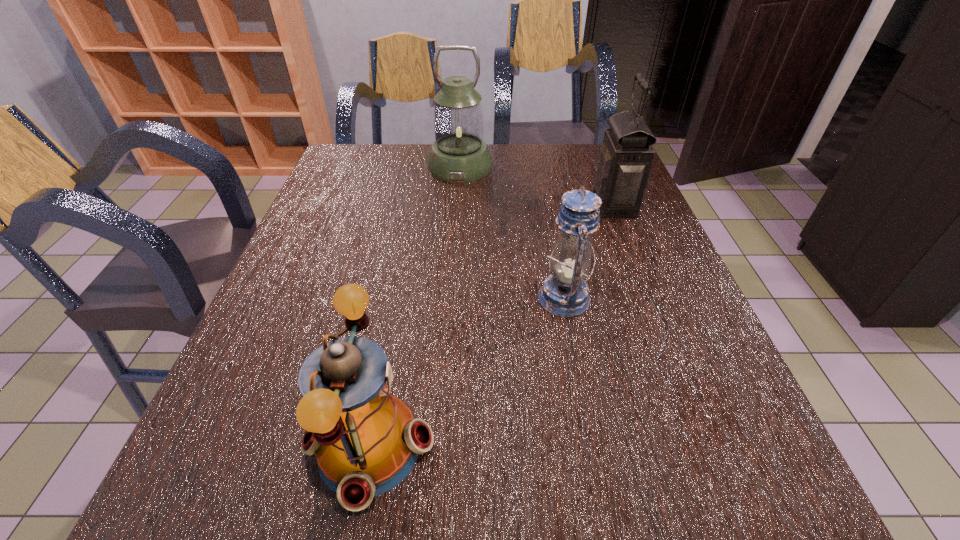
Where is `the farthest object`? This screenshot has height=540, width=960. the farthest object is located at coordinates (459, 154).

Where is `the third nearest object`? Image resolution: width=960 pixels, height=540 pixels. the third nearest object is located at coordinates (626, 156).

This screenshot has height=540, width=960. Identify the location of the third nearest lantern. (626, 156).

Locate an element on the screen. The image size is (960, 540). the second object from right to left is located at coordinates (564, 293).

This screenshot has height=540, width=960. What are the coordinates of `the third lantern from left to right` in the screenshot? It's located at (564, 293).

Identify the location of the nearest object. This screenshot has height=540, width=960. (366, 441).

Where is `free space located on the right of the farthest lantern`? free space located on the right of the farthest lantern is located at coordinates (584, 166).

Where is `free space located on the front-facing side of the second farthest lantern`? The width and height of the screenshot is (960, 540). free space located on the front-facing side of the second farthest lantern is located at coordinates (523, 204).

Locate an element on the screen. free location located on the front-facing side of the second farthest lantern is located at coordinates (567, 204).

This screenshot has height=540, width=960. I want to click on free space located on the front-facing side of the second farthest lantern, so click(474, 204).